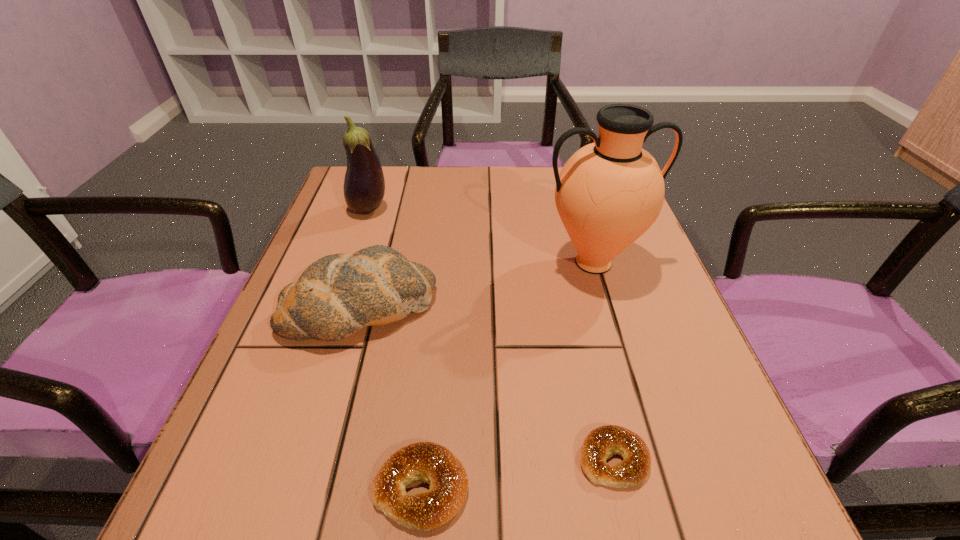
You are a GUI agent. You are given a task and a screenshot of the screen. Output one action in this format:
    pyautogui.click(x=<x>, y=<y>)
    Task: Click on the vacant area situated 0.370m on the right of the third tallest object
    This screenshot has height=540, width=960.
    Given the screenshot: What is the action you would take?
    pyautogui.click(x=633, y=307)

You are a GUI agent. You are given a task and a screenshot of the screen. Output one action in this format:
    pyautogui.click(x=<x>, y=<y>)
    Task: Click on the vacant area situated 0.240m on the back of the taller bagel
    
    Given the screenshot: What is the action you would take?
    pyautogui.click(x=437, y=322)

This screenshot has width=960, height=540. What are the coordinates of `vacant space located 0.170m on the back of the right bagel` in the screenshot? It's located at (586, 340).

This screenshot has height=540, width=960. Find the location of `object at the far edge`. object at the far edge is located at coordinates (364, 185).

Where is `eggplant that is at the left edge`? The height and width of the screenshot is (540, 960). eggplant that is at the left edge is located at coordinates 364,185.

I want to click on bread that is at the left edge, so click(336, 296).

Where is `pitcher that is at the right edge`? Image resolution: width=960 pixels, height=540 pixels. pitcher that is at the right edge is located at coordinates (610, 192).

Where is `bagel located in the right edge section of the desktop`? This screenshot has width=960, height=540. bagel located in the right edge section of the desktop is located at coordinates (600, 443).

Where is `object that is at the far left corner`? This screenshot has height=540, width=960. object that is at the far left corner is located at coordinates (364, 185).

You are a GUI agent. You are given a task and a screenshot of the screen. Output one action in this format:
    pyautogui.click(x=<x>, y=<y>)
    Task: Click on the object that is at the near right corner
    The image size is (960, 540).
    Given the screenshot: What is the action you would take?
    pyautogui.click(x=600, y=443)